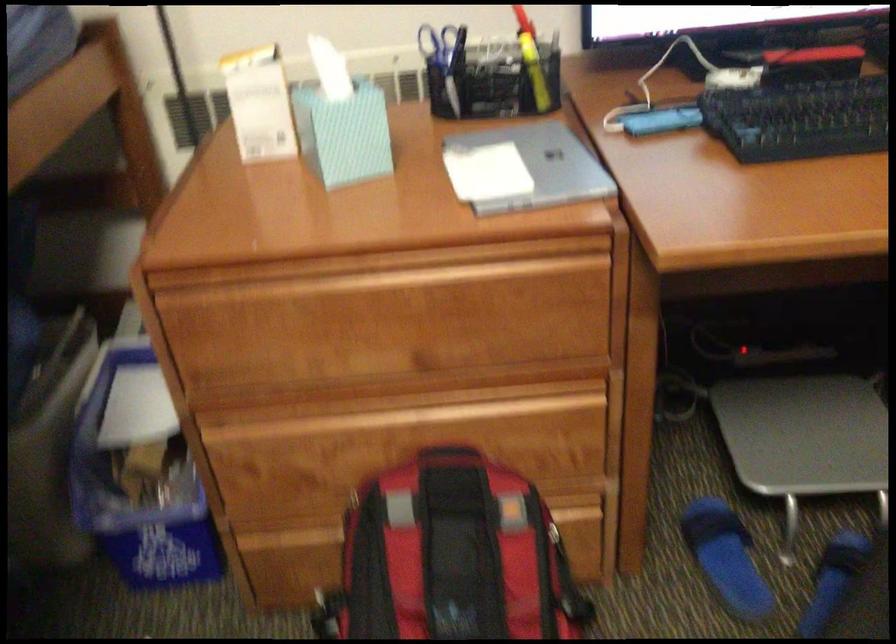
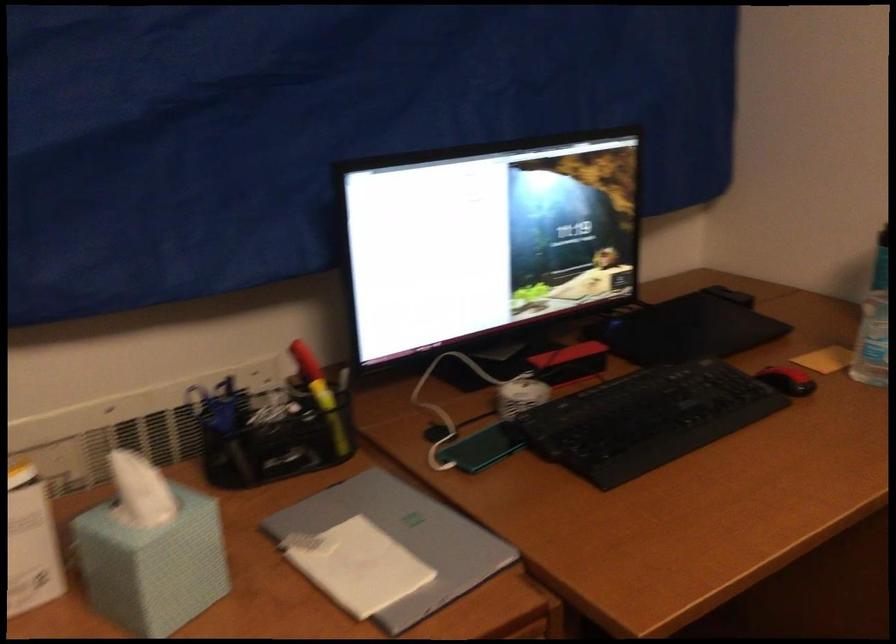
In the second image, find the point that corresponds to point (324, 111) in the first image.

(150, 550)